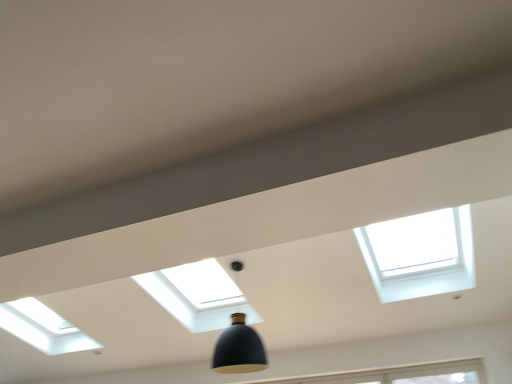
Question: Should I look upward or downward to see matte black pendant light at center?

Choices:
 (A) up
 (B) down

Answer: (B)